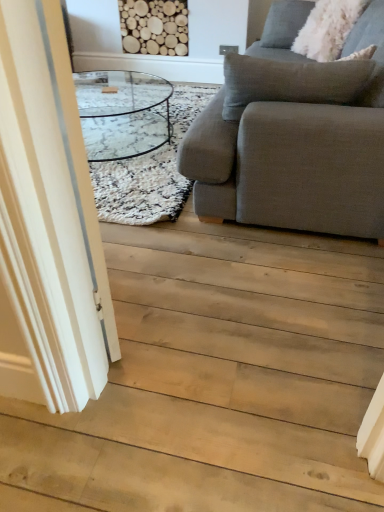
The width and height of the screenshot is (384, 512). Describe the element at coordinates (328, 28) in the screenshot. I see `white fluffy pillow at upper right` at that location.

The height and width of the screenshot is (512, 384). What are the coordinates of `transparent glass door at left` in the screenshot? It's located at (48, 222).

In order to face transparent glass door at left, should I rotate leftwards or rightwards?

To face it directly, rotate left by 17.438 degrees.

What are the coordinates of `white fluffy pillow at upper right` in the screenshot? It's located at (328, 28).

Does white shaggy rug at center have a larger size compared to gray fabric couch at right?

No, white shaggy rug at center is not bigger than gray fabric couch at right.

Which is more to the right, white shaggy rug at center or gray fabric couch at right?

Positioned to the right is gray fabric couch at right.

From the picture: Which is in front, white shaggy rug at center or gray fabric couch at right?

gray fabric couch at right is more forward.

Does white fluffy pillow at upper right contain gray fabric couch at right?

No, white fluffy pillow at upper right does not contain gray fabric couch at right.

Who is smaller, white fluffy pillow at upper right or gray fabric couch at right?

white fluffy pillow at upper right.

Considering the positions of point (361, 56) and point (354, 38), is point (361, 56) closer or farther from the camera than point (354, 38)?

Point (361, 56).

From the image's perspective, which is above, white fluffy pillow at upper right or gray fabric couch at right?

white fluffy pillow at upper right, from the image's perspective.

Who is shorter, white fluffy pillow at upper right or transparent glass door at left?

white fluffy pillow at upper right is shorter.

Is white fluffy pillow at upper right inside or outside of transparent glass door at left?

white fluffy pillow at upper right is not inside transparent glass door at left, it's outside.

Which is behind, point (359, 54) or point (7, 1)?

Positioned behind is point (359, 54).

From the image's perspective, which one is positioned lower, white fluffy pillow at upper right or transparent glass door at left?

transparent glass door at left appears lower in the image.

Measure the distance from transparent glass door at left to white shaggy rug at center.

1.19 meters.

Which is more to the right, transparent glass door at left or white shaggy rug at center?

transparent glass door at left is more to the right.

Considering the relative sizes of transparent glass door at left and white shaggy rug at center in the image provided, is transparent glass door at left bigger than white shaggy rug at center?

No, transparent glass door at left is not bigger than white shaggy rug at center.

From the image's perspective, relative to white shaggy rug at center, is transparent glass door at left above or below?

transparent glass door at left is below white shaggy rug at center.

From a real-world perspective, is white shaggy rug at center under white fluffy pillow at upper right?

Indeed, from a real-world perspective, white shaggy rug at center is positioned beneath white fluffy pillow at upper right.

Is white shaggy rug at center directly adjacent to white fluffy pillow at upper right?

No, white shaggy rug at center is not with white fluffy pillow at upper right.

What's the angular difference between white shaggy rug at center and white fluffy pillow at upper right's facing directions?

The angle between the facing direction of white shaggy rug at center and the facing direction of white fluffy pillow at upper right is 51.3 degrees.

Image resolution: width=384 pixels, height=512 pixels. Identify the location of mat below the white fluffy pillow at upper right (from the image's perspective). pos(150,170).

Is white fluffy pillow at upper right not within white shaggy rug at center?

Indeed, white fluffy pillow at upper right is completely outside white shaggy rug at center.

Is white fluffy pillow at upper right oriented away from white shaggy rug at center?

No, white fluffy pillow at upper right's orientation is not away from white shaggy rug at center.

Is white fluffy pillow at upper right far from white shaggy rug at center?

Absolutely, white fluffy pillow at upper right is distant from white shaggy rug at center.

From the image's perspective, which is below, white fluffy pillow at upper right or white shaggy rug at center?

white shaggy rug at center.

How distant is transparent glass door at left from white fluffy pillow at upper right?

transparent glass door at left is 2.57 meters away from white fluffy pillow at upper right.

From a real-world perspective, between transparent glass door at left and white fluffy pillow at upper right, who is vertically higher?

white fluffy pillow at upper right.

From the image's perspective, is transparent glass door at left beneath white fluffy pillow at upper right?

Correct, transparent glass door at left appears lower than white fluffy pillow at upper right in the image.

From the picture: In terms of width, does transparent glass door at left look wider or thinner when compared to white fluffy pillow at upper right?

transparent glass door at left is thinner than white fluffy pillow at upper right.

This screenshot has width=384, height=512. Find the location of `studio couch on the right of white shaggy rug at center`. studio couch on the right of white shaggy rug at center is located at coordinates (291, 141).

Where is `pillow above the gray fabric couch at right (from a real-world perspective)`? The image size is (384, 512). pillow above the gray fabric couch at right (from a real-world perspective) is located at coordinates (328, 28).

Estimate the real-world distances between objects in this image. Which object is further from transparent glass door at left, white shaggy rug at center or white fluffy pillow at upper right?

Based on the image, white fluffy pillow at upper right appears to be further to transparent glass door at left.

Looking at the image, which one is located further to gray fabric couch at right, white shaggy rug at center or white fluffy pillow at upper right?

white fluffy pillow at upper right.

Looking at the image, which one is located further to gray fabric couch at right, white shaggy rug at center or transparent glass door at left?

Among the two, transparent glass door at left is located further to gray fabric couch at right.

Which object lies nearer to the anchor point white fluffy pillow at upper right, gray fabric couch at right or transparent glass door at left?

The object closer to white fluffy pillow at upper right is gray fabric couch at right.

Estimate the real-world distances between objects in this image. Which object is further from transparent glass door at left, gray fabric couch at right or white shaggy rug at center?

Based on the image, white shaggy rug at center appears to be further to transparent glass door at left.

Based on their spatial positions, is transparent glass door at left or gray fabric couch at right closer to white shaggy rug at center?

gray fabric couch at right.

Based on their spatial positions, is gray fabric couch at right or white fluffy pillow at upper right further from white shaggy rug at center?

Based on the image, white fluffy pillow at upper right appears to be further to white shaggy rug at center.

When comparing their distances from white shaggy rug at center, does white fluffy pillow at upper right or transparent glass door at left seem closer?

transparent glass door at left is closer to white shaggy rug at center.

Identify the location of glass door located between white shaggy rug at center and gray fabric couch at right in the left-right direction. The height and width of the screenshot is (512, 384). (48, 222).

Identify the location of mat between transparent glass door at left and white fluffy pillow at upper right along the z-axis. The image size is (384, 512). (150, 170).

At what (x,y) coordinates should I click in order to perform the action: click on studio couch between white shaggy rug at center and white fluffy pillow at upper right. Please return your answer as a coordinate pair (x, y). The height and width of the screenshot is (512, 384). Looking at the image, I should click on (291, 141).

Locate an element on the screen. studio couch positioned between transparent glass door at left and white fluffy pillow at upper right from near to far is located at coordinates (291, 141).